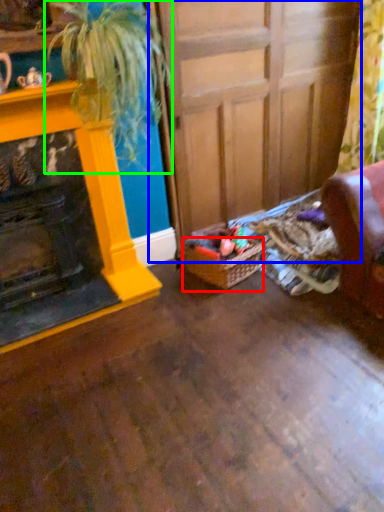
Question: Considering the real-world distances, which object is farthest from basket (highlighted by a red box)? door (highlighted by a blue box) or houseplant (highlighted by a green box)?

Choices:
 (A) door
 (B) houseplant

Answer: (B)